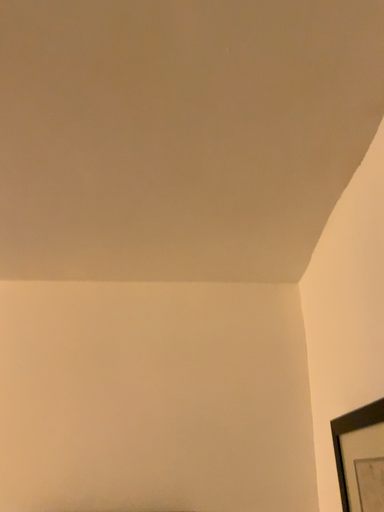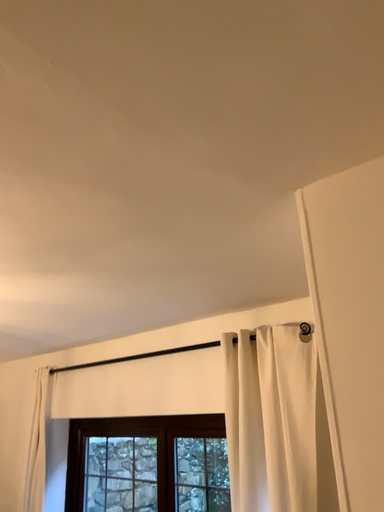
Question: How did the camera likely rotate when shooting the video?

Choices:
 (A) rotated upward
 (B) rotated downward

Answer: (B)